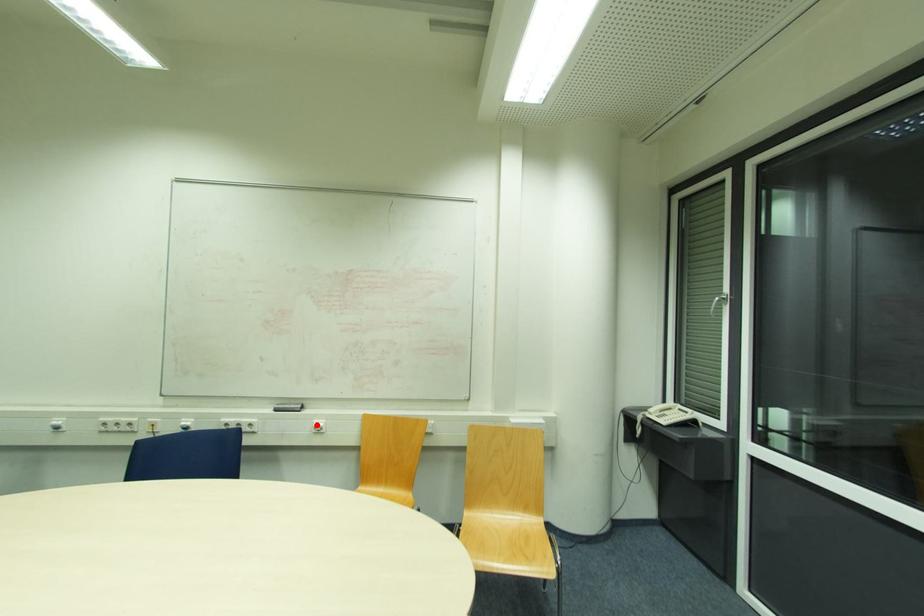
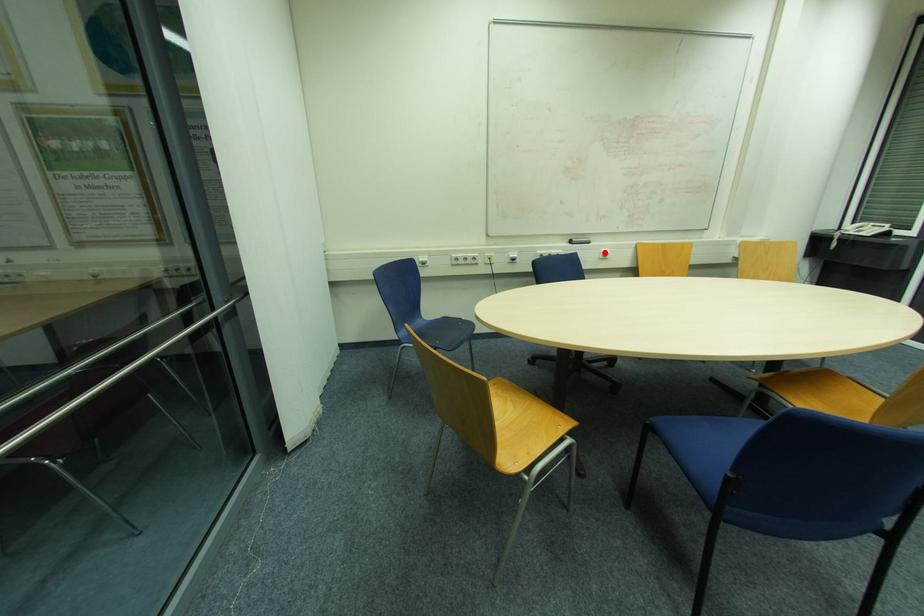
I am providing you with two images of the same scene from different viewpoints. A red point is marked on the first image and another point is marked on the second image. Is the marked point in image1 the same physical position as the marked point in image2?

Yes